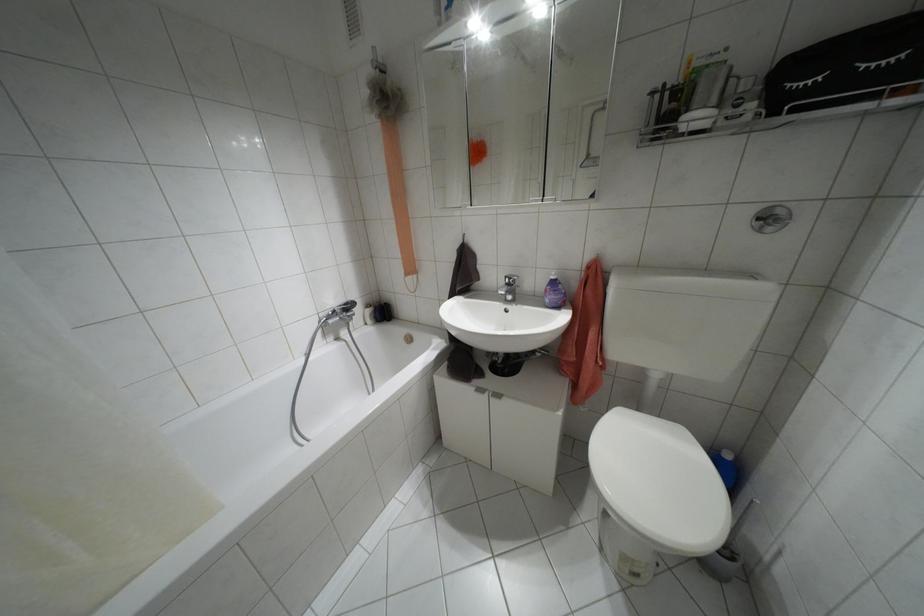
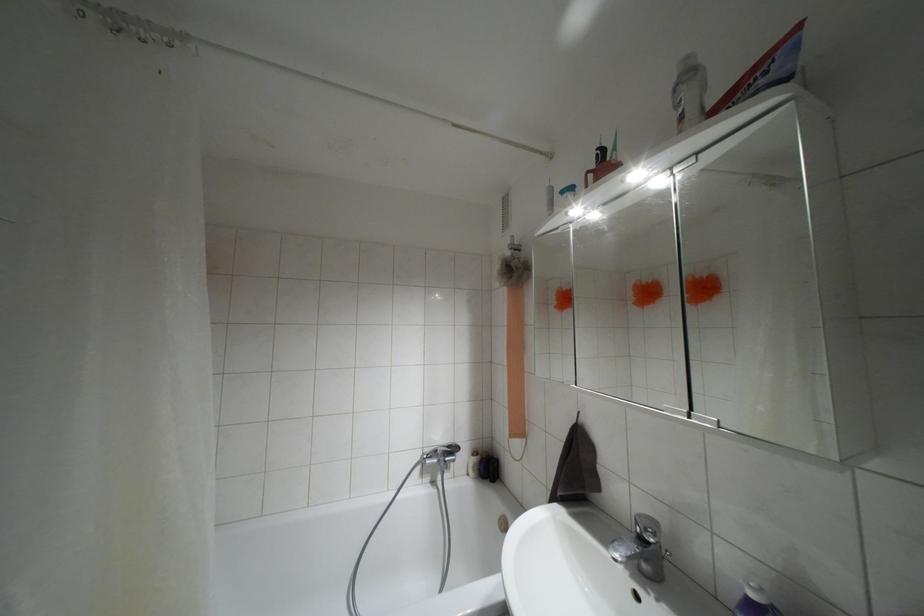
The point at (345, 304) is marked in the first image. Where is the corresponding point in the second image?

(447, 446)